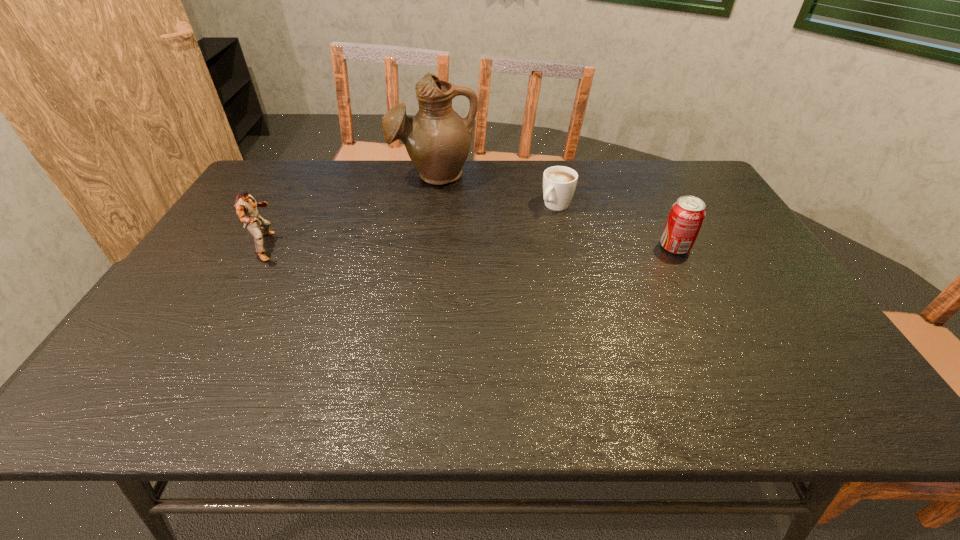
Image resolution: width=960 pixels, height=540 pixels. I want to click on vacant space located with the handle on the side of the shortest object, so pyautogui.click(x=471, y=283).

Where is `vacant space located 0.060m with the handle on the side of the shortest object`? The height and width of the screenshot is (540, 960). vacant space located 0.060m with the handle on the side of the shortest object is located at coordinates (538, 224).

Where is `free spot located with the handle on the side of the shortest object`? free spot located with the handle on the side of the shortest object is located at coordinates (517, 242).

Find the location of a particular element. free region located 0.090m at the spout of the third object from right to left is located at coordinates (426, 208).

The image size is (960, 540). In order to click on vacant space located 0.250m at the spout of the third object from right to left in this screenshot , I will do `click(419, 240)`.

The height and width of the screenshot is (540, 960). Identify the location of free space located 0.270m at the spout of the third object from right to left. (418, 245).

Identify the location of cappuccino that is at the far edge. Image resolution: width=960 pixels, height=540 pixels. (559, 182).

The height and width of the screenshot is (540, 960). I want to click on pitcher that is at the far edge, so click(438, 141).

At what (x,y) coordinates should I click in order to perform the action: click on object present at the left edge. Please return your answer as a coordinate pair (x, y). The image size is (960, 540). Looking at the image, I should click on (246, 207).

The width and height of the screenshot is (960, 540). Find the location of `vacant space at the far edge of the desktop`. vacant space at the far edge of the desktop is located at coordinates (645, 170).